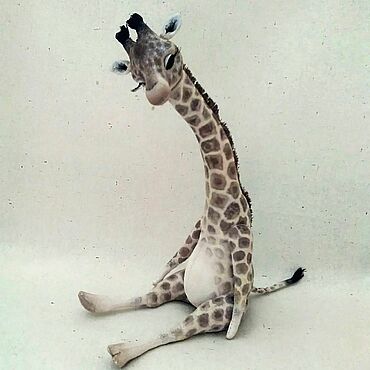
The height and width of the screenshot is (370, 370). I want to click on teddy bear, so click(223, 206).